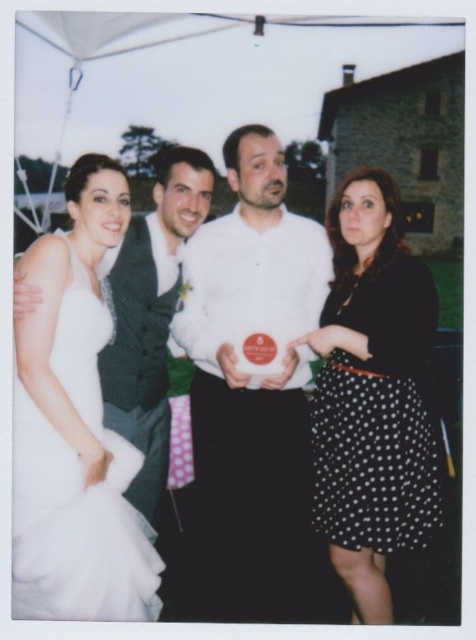
Can you confirm if white satin dress at left is positioned above black dotted skirt at right?

Correct, white satin dress at left is located above black dotted skirt at right.

Does white satin dress at left appear under black dotted skirt at right?

No.

The image size is (476, 640). I want to click on white satin dress at left, so point(373,396).

Does white matte shirt at center have a lesser height compared to white tulle dress at left?

In fact, white matte shirt at center may be taller than white tulle dress at left.

The image size is (476, 640). What do you see at coordinates (255, 394) in the screenshot?
I see `white matte shirt at center` at bounding box center [255, 394].

Between point (308, 609) and point (32, 502), which one is positioned behind?

The point (308, 609) is behind.

Image resolution: width=476 pixels, height=640 pixels. Identify the location of white matte shirt at center. (255, 394).

Which is below, white satin dress at left or white tulle dress at left?

white tulle dress at left

Who is shorter, white satin dress at left or white tulle dress at left?

Standing shorter between the two is white tulle dress at left.

Where is `white satin dress at left`? white satin dress at left is located at coordinates (373, 396).

The width and height of the screenshot is (476, 640). What are the coordinates of `white satin dress at left` in the screenshot? It's located at (373, 396).